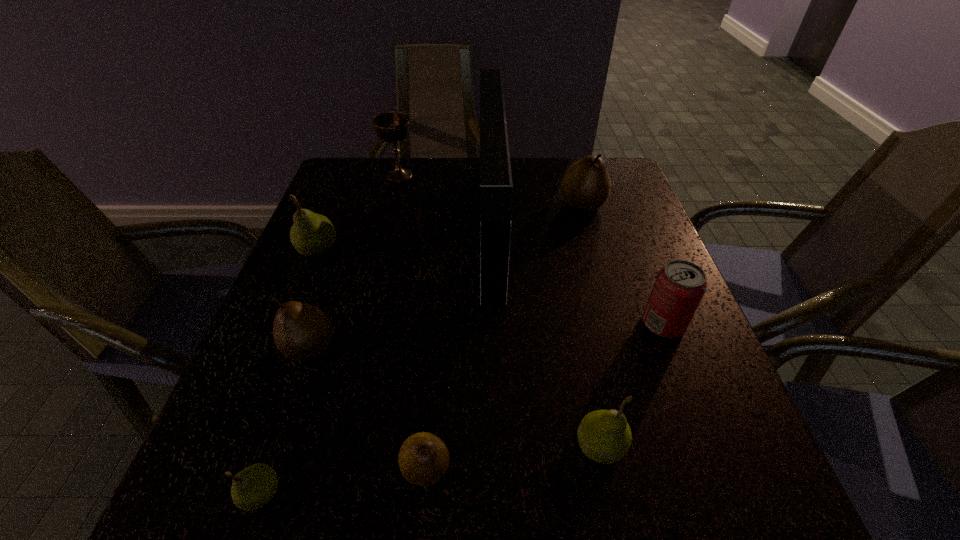
Identify the location of the sixth object from left to right. (496, 187).

Where is `the tallest object`? This screenshot has width=960, height=540. the tallest object is located at coordinates (496, 187).

The width and height of the screenshot is (960, 540). I want to click on chalice, so click(x=392, y=127).

The image size is (960, 540). In order to click on the farthest pear in this screenshot , I will do `click(586, 185)`.

Find the location of a particular element. the rightmost brown pear is located at coordinates (586, 185).

The height and width of the screenshot is (540, 960). What are the coordinates of `the fifth nearest pear` in the screenshot? It's located at (312, 234).

This screenshot has height=540, width=960. I want to click on the biggest green pear, so click(312, 234).

The image size is (960, 540). Find the location of `soda can`. soda can is located at coordinates (680, 285).

What are the coordinates of `the second smallest brown pear` in the screenshot? It's located at (301, 331).

Where is `the leftmost brown pear`? This screenshot has width=960, height=540. the leftmost brown pear is located at coordinates (301, 331).